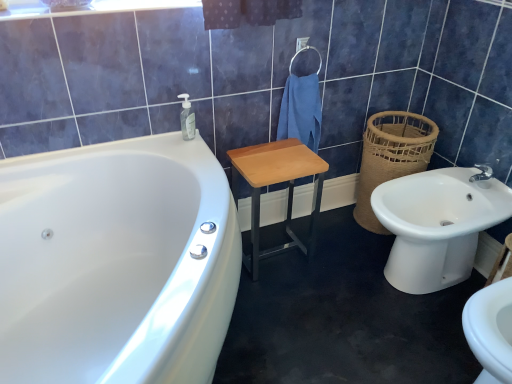
You are a GUI agent. You are given a task and a screenshot of the screen. Output one action in this format:
    pyautogui.click(x=<x>, y=<y>)
    Task: Click on the vacant area that lies between wooden/matte step stool at center and brown woven basket at right
    This screenshot has height=384, width=512.
    Given the screenshot: What is the action you would take?
    pyautogui.click(x=333, y=235)